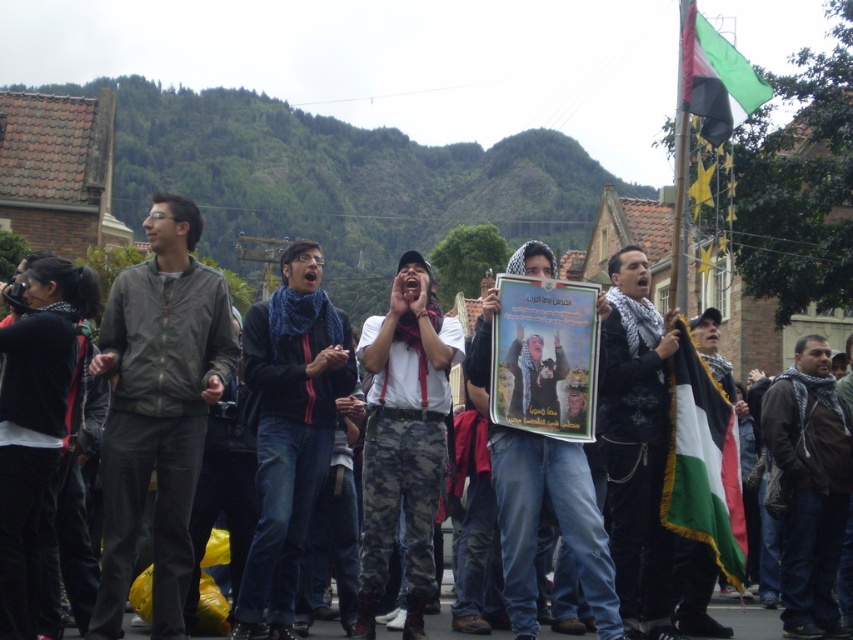
Question: Does white paper poster at center appear on the left side of green and white fabric flag at center?

Choices:
 (A) yes
 (B) no

Answer: (A)

Question: Does dark gray jacket at center appear on the right side of white scarf at center?

Choices:
 (A) no
 (B) yes

Answer: (A)

Question: Which point is farther to the camera?

Choices:
 (A) (799, 637)
 (B) (686, 442)

Answer: (A)

Question: Based on their relative distances, which object is nearer to the dark gray jacket at center?

Choices:
 (A) dark blue scarf at center
 (B) white scarf at center

Answer: (A)

Question: Can you confirm if dark gray jacket at center is bigger than dark blue scarf at center?

Choices:
 (A) yes
 (B) no

Answer: (A)

Question: Estimate the real-world distances between objects in this image. Which object is farther from the green fabric flag at upper right?

Choices:
 (A) white paper poster at center
 (B) dark gray jacket at center
 (C) knitted scarf at center
 (D) dark blue scarf at center

Answer: (B)